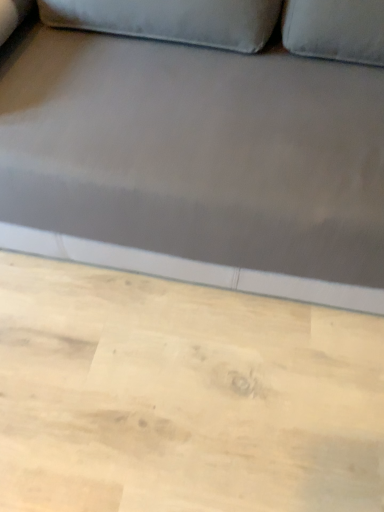
Find the location of a particular element. vacant space situated above light wood plywood at lower center (from a real-world perspective) is located at coordinates (167, 379).